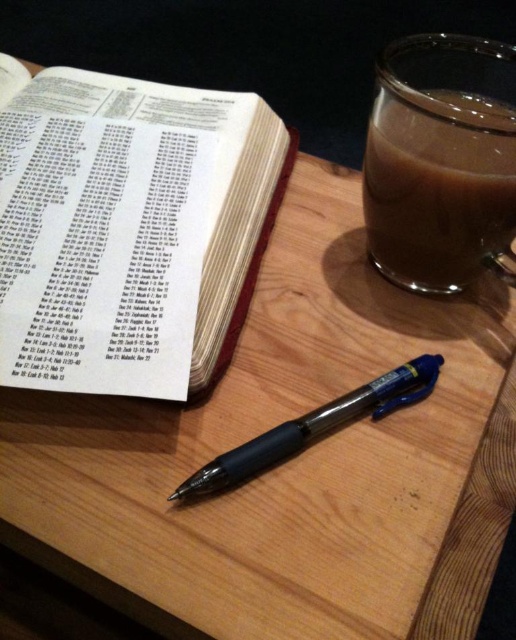
You are trying to write a note on the white paper book at upper left but need to access the black plastic pen at center. Is the pen currently blocking your view of the book?

The black plastic pen at center is behind white paper book at upper left, so it is not blocking the view of the white paper book at upper left. You can access the pen without moving the book.

You are looking at the wooden surface with the open book and the glass mug. There are two points marked on the image. Which point is closer to you, point at [172,257] or point at [398,134]?

Point at [398,134] is closer to you because it is in front of point at [172,257].